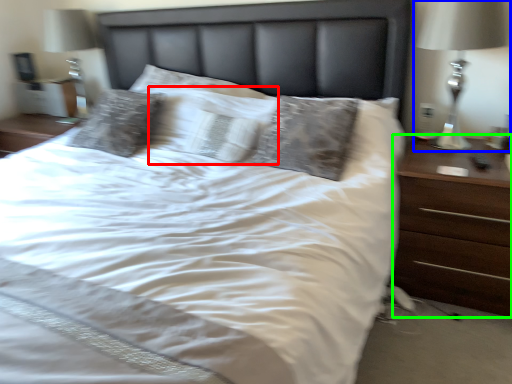
Question: Considering the real-world distances, which object is farthest from pillow (highlighted by a red box)? bedside lamp (highlighted by a blue box) or nightstand (highlighted by a green box)?

Choices:
 (A) bedside lamp
 (B) nightstand

Answer: (A)